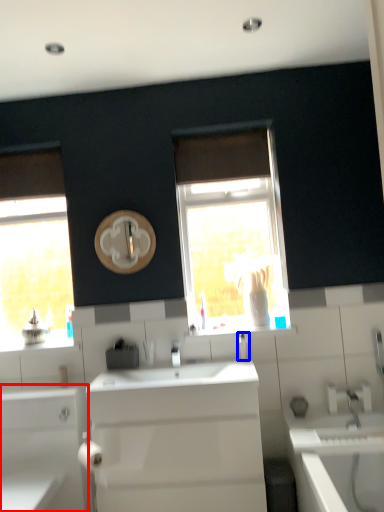
Question: Which of the following is the farthest to the observer, bathroom cabinet (highlighted by a red box) or soap dispenser (highlighted by a blue box)?

Choices:
 (A) bathroom cabinet
 (B) soap dispenser

Answer: (B)